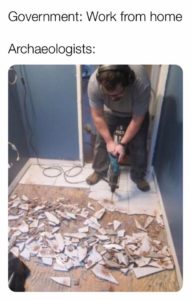
This screenshot has height=300, width=191. What are the coordinates of `cord` in the screenshot? It's located at (24, 83).